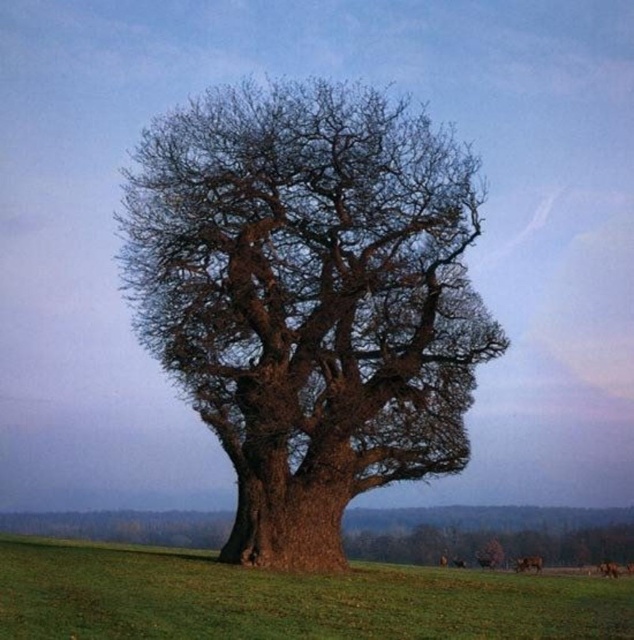
You are standing in front of the ancient oak tree and want to determine the relative positions of two points marked on the tree. Which point is closer to you, point (307, 557) or point (8, 563)?

Point (8, 563) is closer to you because it is closer to the camera than point (307, 557).

You are a landscape photographer planning to capture the brown rough bark oak tree at center and the green grassy field at center in a single frame. Which object should you focus on first if you want to ensure both are in sharp focus?

The brown rough bark oak tree at center is bigger than the green grassy field at center, so you should focus on the brown rough bark oak tree at center first to ensure both are in sharp focus.